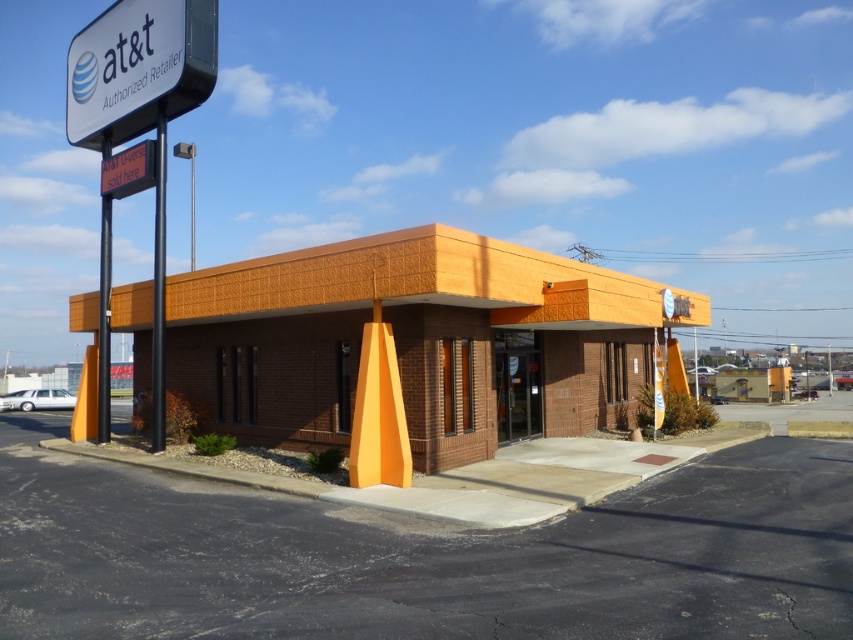
Question: Is orange brick motel at center to the left of white plastic sign at upper left from the viewer's perspective?

Choices:
 (A) no
 (B) yes

Answer: (A)

Question: Among these objects, which one is farthest from the camera?

Choices:
 (A) orange brick motel at center
 (B) orange digital sign at upper left
 (C) white plastic sign at upper left

Answer: (B)

Question: Which of the following is the farthest from the observer?

Choices:
 (A) orange digital sign at upper left
 (B) white plastic sign at upper left
 (C) orange brick motel at center

Answer: (A)

Question: Which point appears farthest from the camera in this image?

Choices:
 (A) (115, 184)
 (B) (312, 333)
 (C) (99, 90)

Answer: (C)

Question: Can you confirm if orange brick motel at center is positioned below orange digital sign at upper left?

Choices:
 (A) yes
 (B) no

Answer: (A)

Question: Does orange brick motel at center appear over white plastic sign at upper left?

Choices:
 (A) yes
 (B) no

Answer: (B)